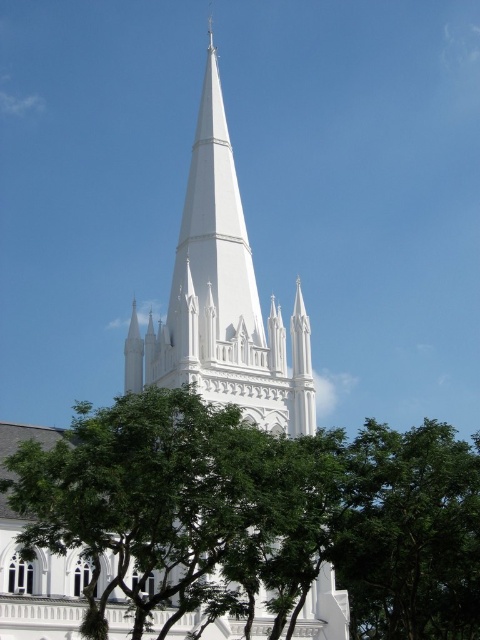
In the scene shown: You are standing in front of the white church and notice two green leafy trees framing the view. Which tree is closer to you, the green leafy tree at lower left or the green leafy tree at lower right?

The green leafy tree at lower left is closer to you since it is in front of the green leafy tree at lower right.